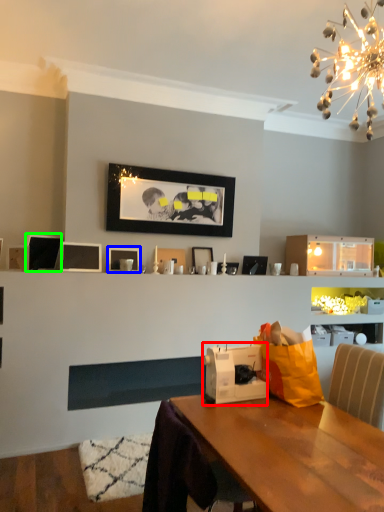
Question: Which object is the farthest from appliance (highlighted by a red box)? Choose among these: picture frame (highlighted by a blue box) or picture frame (highlighted by a green box).

Choices:
 (A) picture frame
 (B) picture frame

Answer: (B)